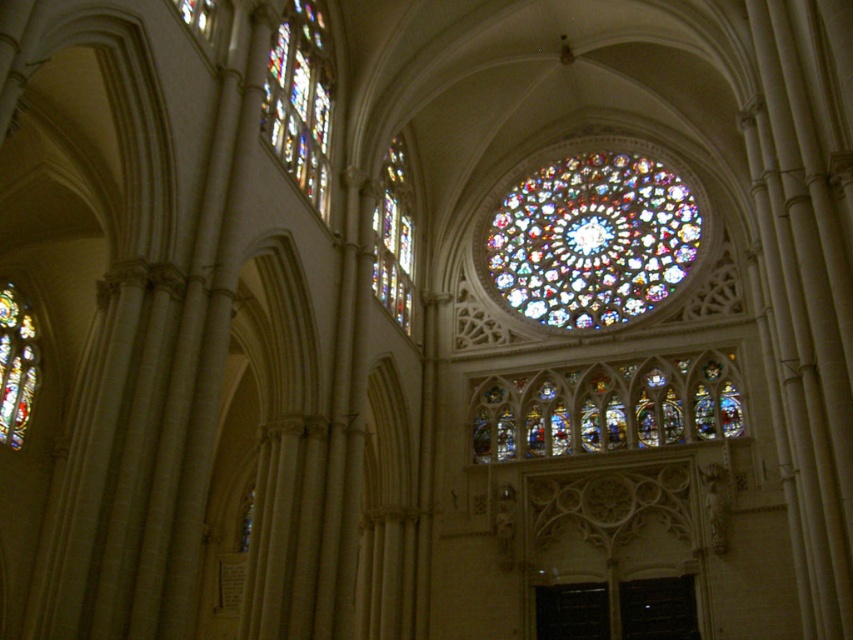
Is stained glass window at left below clear glass window at upper left?

Indeed, stained glass window at left is positioned under clear glass window at upper left.

Can you confirm if stained glass window at left is bigger than clear glass window at upper left?

Yes, stained glass window at left is bigger than clear glass window at upper left.

Does point (30, 404) come in front of point (187, 1)?

No.

This screenshot has width=853, height=640. I want to click on stained glass window at left, so click(x=16, y=365).

Looking at this image, who is taller, multicolored stained glass at center or stained glass window at left?

With more height is multicolored stained glass at center.

Is point (691, 240) positioned in front of point (0, 419)?

That is False.

Locate an element on the screen. This screenshot has height=640, width=853. multicolored stained glass at center is located at coordinates (590, 240).

Between stained glass at upper left and multicolored stained glass at upper center, which one has less height?

stained glass at upper left is shorter.

Who is positioned more to the right, stained glass at upper left or multicolored stained glass at upper center?

multicolored stained glass at upper center is more to the right.

Describe the element at coordinates (300, 99) in the screenshot. Image resolution: width=853 pixels, height=640 pixels. I see `stained glass at upper left` at that location.

Image resolution: width=853 pixels, height=640 pixels. Identify the location of stained glass at upper left. (300, 99).